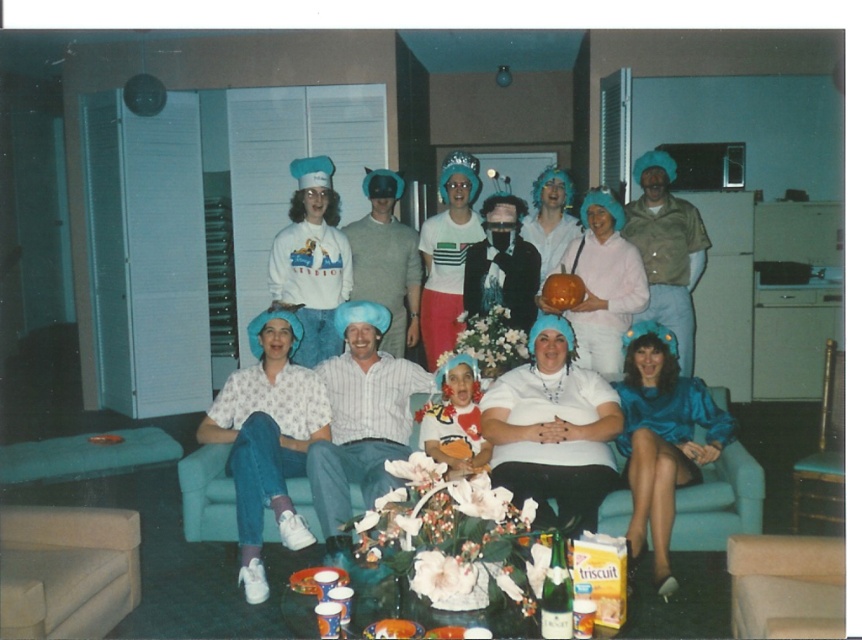
You are at the center of the living room and want to place a new decorative item on the coffee table. The coffee table is located at point (704, 515). Is there enough space at the coffee table to place a small vase next to the existing bouquet of flowers?

The coffee table at point (704, 515) has a bouquet of flowers, but there is no information provided about available space. Therefore, it is uncertain if there is enough room for the small vase next to the bouquet.

You are a guest at the party and want to sit next to the shiny blue dress at lower right. Where should you sit relative to the teal fabric couch at center?

To sit next to the shiny blue dress at lower right, you should sit to the right of the teal fabric couch at center since the teal fabric couch at center is located to the left of the shiny blue dress at lower right.